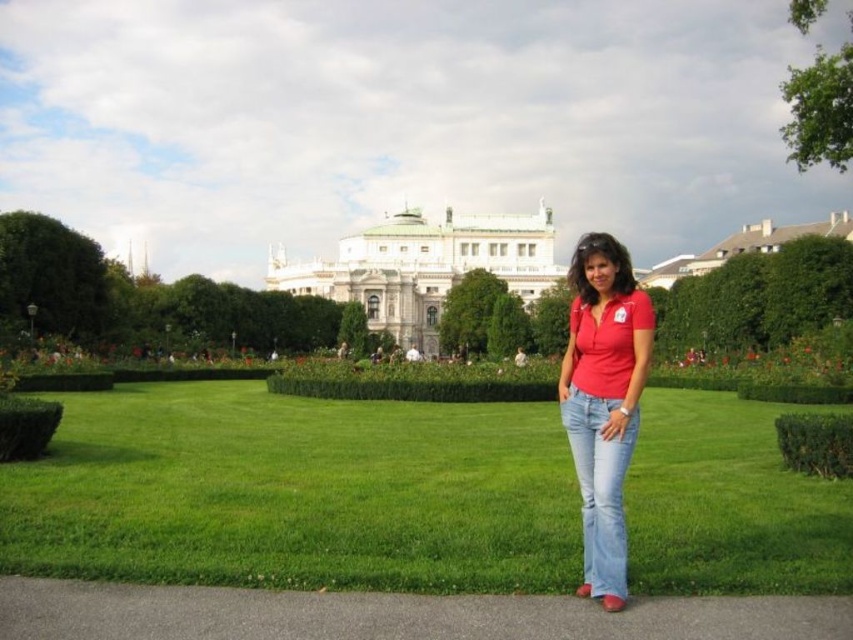
Question: Can you confirm if green grass at center is bigger than light blue denim jeans at center?

Choices:
 (A) no
 (B) yes

Answer: (B)

Question: Is green leafy hedge at upper right further to camera compared to light blue denim jeans at center?

Choices:
 (A) yes
 (B) no

Answer: (A)

Question: Is white stone building at center positioned in front of light blue denim jeans at center?

Choices:
 (A) no
 (B) yes

Answer: (A)

Question: Which of the following is the farthest from the observer?

Choices:
 (A) (692, 321)
 (B) (212, 488)
 (C) (601, 531)

Answer: (A)

Question: Which object appears closest to the camera in this image?

Choices:
 (A) white stone building at center
 (B) light blue denim jeans at center
 (C) matte red shirt at center

Answer: (C)

Question: Which point appears closest to the camera in this image?

Choices:
 (A) (379, 296)
 (B) (677, 344)

Answer: (B)